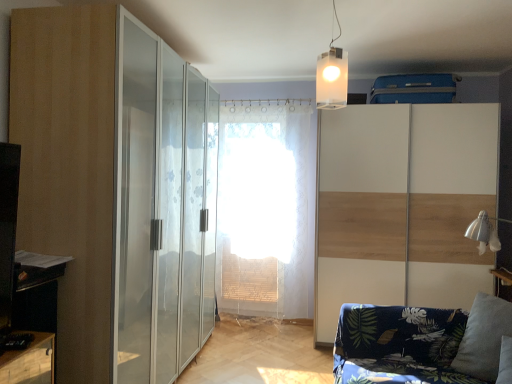
Question: Considering the relative sizes of white sheer curtain at center and transparent glass wardrobe at center, the 2th screen door viewed from the right, in the image provided, is white sheer curtain at center smaller than transparent glass wardrobe at center, the 2th screen door viewed from the right,?

Choices:
 (A) yes
 (B) no

Answer: (A)

Question: Is white sheer curtain at center outside transparent glass wardrobe at center, which is counted as the 1th screen door, starting from the left?

Choices:
 (A) yes
 (B) no

Answer: (A)

Question: Is white sheer curtain at center closer to camera compared to transparent glass wardrobe at center, which is counted as the 1th screen door, starting from the left?

Choices:
 (A) no
 (B) yes

Answer: (A)

Question: Does white sheer curtain at center appear on the right side of transparent glass wardrobe at center, the 2th screen door viewed from the right?

Choices:
 (A) yes
 (B) no

Answer: (A)

Question: Is white sheer curtain at center oriented away from transparent glass wardrobe at center, the 2th screen door viewed from the right?

Choices:
 (A) yes
 (B) no

Answer: (B)

Question: In terms of height, does translucent plastic cube at upper center look taller or shorter compared to gray fabric pillow at lower right?

Choices:
 (A) short
 (B) tall

Answer: (B)

Question: Is translucent plastic cube at upper center to the left or to the right of gray fabric pillow at lower right in the image?

Choices:
 (A) left
 (B) right

Answer: (A)

Question: Considering the positions of translucent plastic cube at upper center and gray fabric pillow at lower right in the image, is translucent plastic cube at upper center wider or thinner than gray fabric pillow at lower right?

Choices:
 (A) thin
 (B) wide

Answer: (A)

Question: Does point (340, 97) appear closer or farther from the camera than point (505, 324)?

Choices:
 (A) farther
 (B) closer

Answer: (A)

Question: Is transparent glass wardrobe at center, which is counted as the 1th screen door, starting from the left, to the left or to the right of gray fabric pillow at lower right in the image?

Choices:
 (A) right
 (B) left

Answer: (B)

Question: Is transparent glass wardrobe at center, which is counted as the 1th screen door, starting from the left, in front of or behind gray fabric pillow at lower right in the image?

Choices:
 (A) front
 (B) behind

Answer: (B)

Question: Choose the correct answer: Is transparent glass wardrobe at center, the 2th screen door viewed from the right, inside gray fabric pillow at lower right or outside it?

Choices:
 (A) inside
 (B) outside

Answer: (B)

Question: From the image's perspective, relative to gray fabric pillow at lower right, is transparent glass wardrobe at center, which is counted as the 1th screen door, starting from the left, above or below?

Choices:
 (A) below
 (B) above

Answer: (B)

Question: Considering the positions of translucent plastic cube at upper center and white wood screen door at right, the 1th screen door when ordered from right to left, in the image, is translucent plastic cube at upper center taller or shorter than white wood screen door at right, the 1th screen door when ordered from right to left,?

Choices:
 (A) tall
 (B) short

Answer: (B)

Question: Is translucent plastic cube at upper center situated inside white wood screen door at right, the 1th screen door when ordered from right to left, or outside?

Choices:
 (A) inside
 (B) outside

Answer: (B)